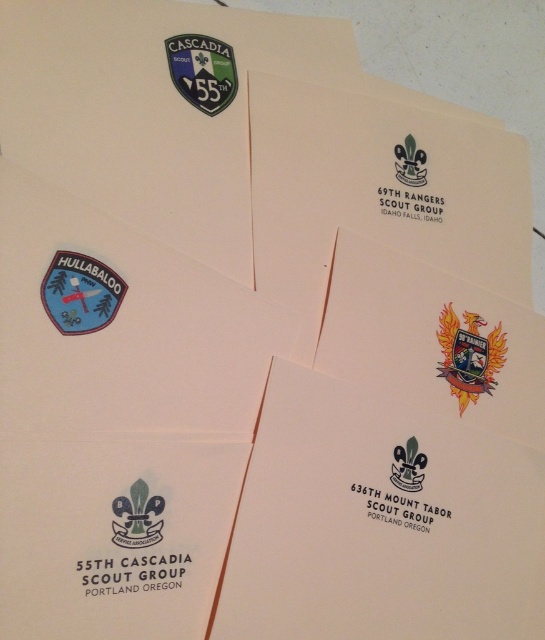
Question: Does matte fabric patch at lower left appear on the right side of blue fabric patch at lower left?

Choices:
 (A) no
 (B) yes

Answer: (B)

Question: Which object is the farthest from the green matte patch at upper left?

Choices:
 (A) white matte fleur-de-lis at center
 (B) green matte logo at lower left

Answer: (A)

Question: Considering the relative positions of blue fabric patch at lower left and green matte logo at lower left in the image provided, where is blue fabric patch at lower left located with respect to green matte logo at lower left?

Choices:
 (A) below
 (B) above

Answer: (B)

Question: Which point is farther to the camera?

Choices:
 (A) blue fabric patch at lower left
 (B) green matte patch at upper left

Answer: (B)

Question: Among these points, which one is farthest from the camera?

Choices:
 (A) (60, 285)
 (B) (172, 413)

Answer: (B)

Question: Does matte fabric patch at lower left have a larger size compared to white matte fleur-de-lis at center?

Choices:
 (A) no
 (B) yes

Answer: (B)